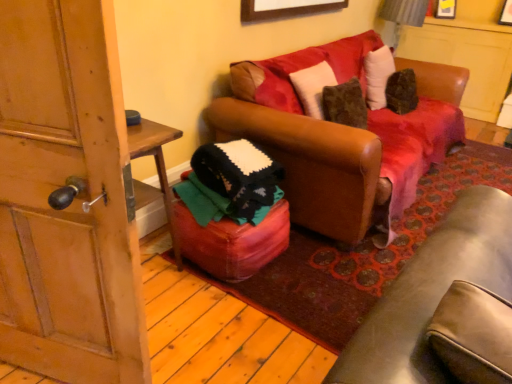
The image size is (512, 384). Find the location of `leather ottoman at center`. leather ottoman at center is located at coordinates (233, 242).

Describe the element at coordinates (286, 8) in the screenshot. I see `wooden picture frame at upper center` at that location.

Identify the location of leather ottoman at center. The height and width of the screenshot is (384, 512). (233, 242).

Based on their sizes in the image, would you say leather ottoman at center is bigger or smaller than brown leather couch at center?

Considering their sizes, leather ottoman at center takes up less space than brown leather couch at center.

What's the angular difference between leather ottoman at center and brown leather couch at center's facing directions?

The angle between the facing direction of leather ottoman at center and the facing direction of brown leather couch at center is 0.000268 degrees.

From the image's perspective, is leather ottoman at center located above or below brown leather couch at center?

Clearly, from the image's perspective, leather ottoman at center is below brown leather couch at center.

Considering the sizes of objects leather ottoman at center and brown leather couch at center in the image provided, who is taller, leather ottoman at center or brown leather couch at center?

brown leather couch at center.

Is wooden door at left far away from brown leather couch at center?

Yes.

From the picture: How many degrees apart are the facing directions of wooden door at left and brown leather couch at center?

wooden door at left and brown leather couch at center are facing 71.5 degrees away from each other.

Considering the positions of objects wooden door at left and brown leather couch at center in the image provided, who is in front, wooden door at left or brown leather couch at center?

wooden door at left is closer to the camera.

Can leather ottoman at center be found inside brown leather couch at center?

Actually, leather ottoman at center is outside brown leather couch at center.

Is brown leather couch at center oriented away from leather ottoman at center?

brown leather couch at center does not have its back to leather ottoman at center.

Find the location of `stool lying behind the brown leather couch at center`. stool lying behind the brown leather couch at center is located at coordinates (233, 242).

Is wooden door at left aimed at wooden picture frame at upper center?

No.

Is wooden door at left not close to wooden picture frame at upper center?

That's right, there is a large distance between wooden door at left and wooden picture frame at upper center.

Looking at this image, which of these two, wooden door at left or wooden picture frame at upper center, is bigger?

With larger size is wooden door at left.

From the image's perspective, which is above, wooden door at left or wooden picture frame at upper center?

wooden picture frame at upper center.

Locate an element on the screen. stool on the left of wooden picture frame at upper center is located at coordinates (233, 242).

Does wooden picture frame at upper center have a larger size compared to leather ottoman at center?

No.

Measure the distance between wooden picture frame at upper center and leather ottoman at center.

wooden picture frame at upper center and leather ottoman at center are 1.35 meters apart.

Visually, is wooden picture frame at upper center positioned to the left or to the right of leather ottoman at center?

In the image, wooden picture frame at upper center appears on the right side of leather ottoman at center.

Considering the relative sizes of wooden picture frame at upper center and wooden door at left in the image provided, is wooden picture frame at upper center smaller than wooden door at left?

Indeed, wooden picture frame at upper center has a smaller size compared to wooden door at left.

Is point (318, 11) less distant than point (90, 223)?

No, (318, 11) is further to viewer.

Which object is thinner, wooden picture frame at upper center or wooden door at left?

wooden picture frame at upper center.

Is leather ottoman at center not within wooden door at left?

Yes, leather ottoman at center is not within wooden door at left.

Based on the photo, from the image's perspective, does leather ottoman at center appear lower than wooden door at left?

Indeed, from the image's perspective, leather ottoman at center is shown beneath wooden door at left.

Considering the relative sizes of leather ottoman at center and wooden door at left in the image provided, is leather ottoman at center shorter than wooden door at left?

Indeed, leather ottoman at center has a lesser height compared to wooden door at left.

Which object is further away from the camera, leather ottoman at center or wooden door at left?

leather ottoman at center is more distant.

In the image, there is a brown leather couch at center. Where is `stool below it (from the image's perspective)`? The image size is (512, 384). stool below it (from the image's perspective) is located at coordinates (233, 242).

The width and height of the screenshot is (512, 384). In order to click on door above the brown leather couch at center (from a real-world perspective) in this screenshot , I will do `click(73, 203)`.

Consider the image. Estimate the real-world distances between objects in this image. Which object is closer to wooden picture frame at upper center, leather ottoman at center or wooden door at left?

The object closer to wooden picture frame at upper center is leather ottoman at center.

Estimate the real-world distances between objects in this image. Which object is further from brown leather couch at center, leather ottoman at center or wooden picture frame at upper center?

Among the two, wooden picture frame at upper center is located further to brown leather couch at center.

Which object lies further to the anchor point brown leather couch at center, wooden door at left or leather ottoman at center?

wooden door at left is positioned further to the anchor brown leather couch at center.

When comparing their distances from leather ottoman at center, does brown leather couch at center or wooden door at left seem further?

wooden door at left lies further to leather ottoman at center than the other object.

Considering their positions, is wooden door at left positioned closer to brown leather couch at center than wooden picture frame at upper center?

wooden picture frame at upper center lies closer to brown leather couch at center than the other object.

Looking at the image, which one is located further to leather ottoman at center, wooden picture frame at upper center or wooden door at left?

wooden picture frame at upper center is further to leather ottoman at center.

Which object lies further to the anchor point wooden door at left, wooden picture frame at upper center or brown leather couch at center?

wooden picture frame at upper center.

Looking at the image, which one is located further to wooden picture frame at upper center, brown leather couch at center or wooden door at left?

Among the two, wooden door at left is located further to wooden picture frame at upper center.

Find the location of a particular element. stool between wooden door at left and brown leather couch at center in the horizontal direction is located at coordinates (233, 242).

What are the coordinates of `stool located between wooden door at left and wooden picture frame at upper center in the depth direction` in the screenshot? It's located at pos(233,242).

Find the location of a particular element. This screenshot has height=384, width=512. studio couch positioned between wooden door at left and wooden picture frame at upper center from near to far is located at coordinates pyautogui.click(x=345, y=140).

The width and height of the screenshot is (512, 384). I want to click on studio couch between wooden picture frame at upper center and leather ottoman at center from top to bottom, so click(345, 140).